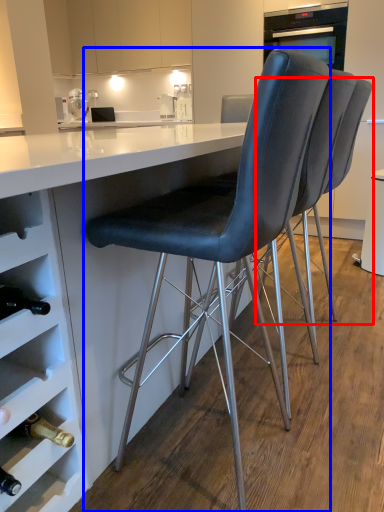
Question: Which point is closer to the camera, chair (highlighted by a red box) or chair (highlighted by a blue box)?

Choices:
 (A) chair
 (B) chair

Answer: (B)